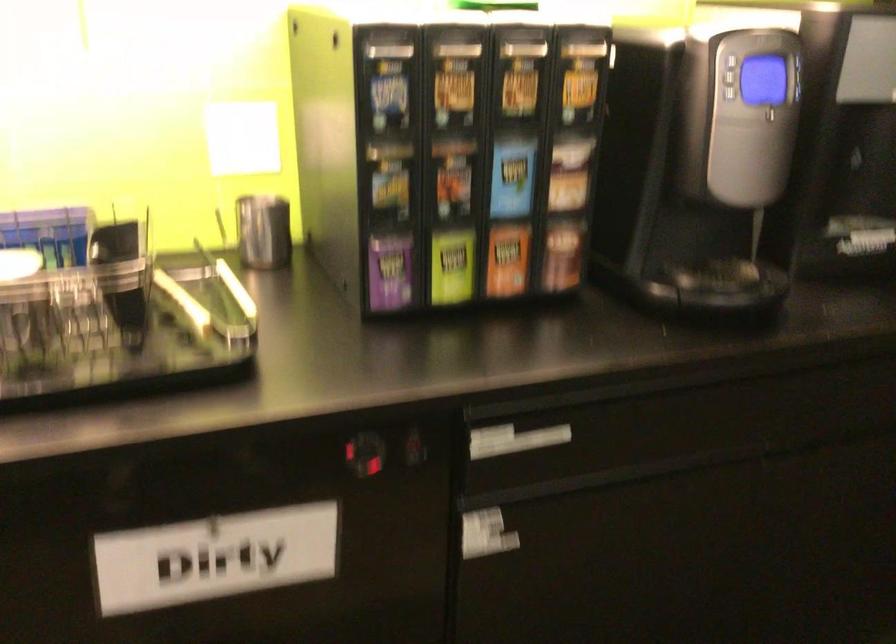
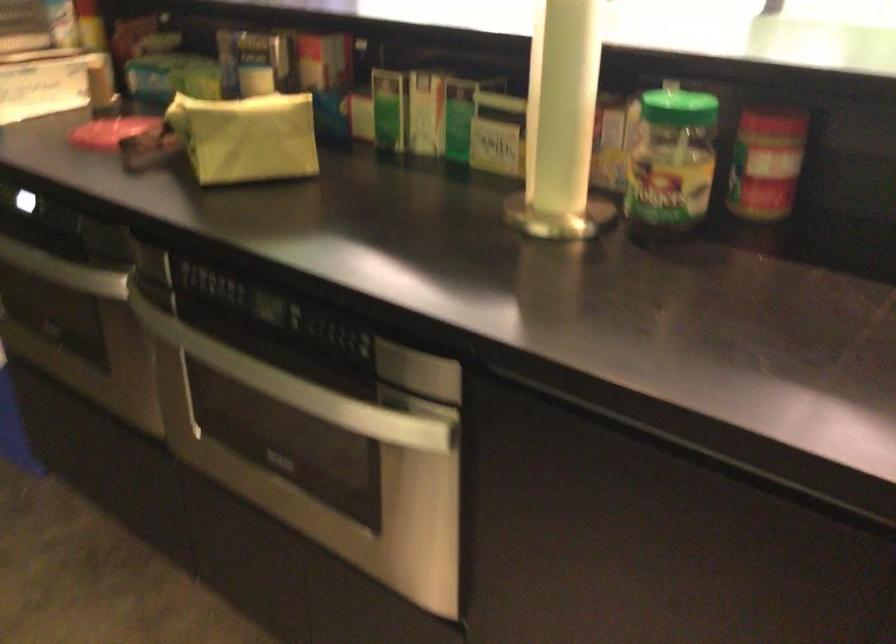
Based on the continuous images, in which direction is the camera rotating?

The camera's rotation is toward right-down.